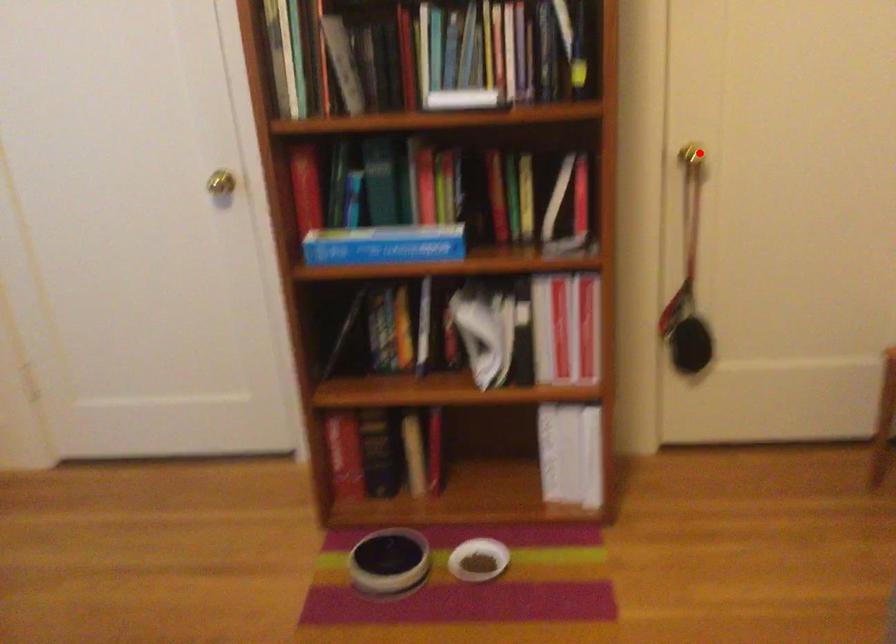
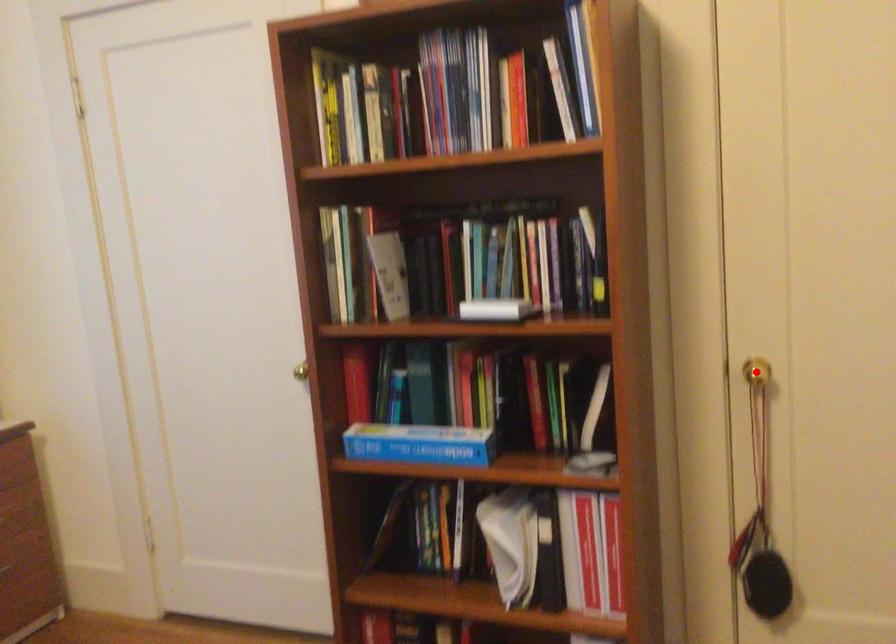
I am providing you with two images of the same scene from different viewpoints. A red point is marked on the first image and another point is marked on the second image. Is the marked point in image1 the same physical position as the marked point in image2?

Yes